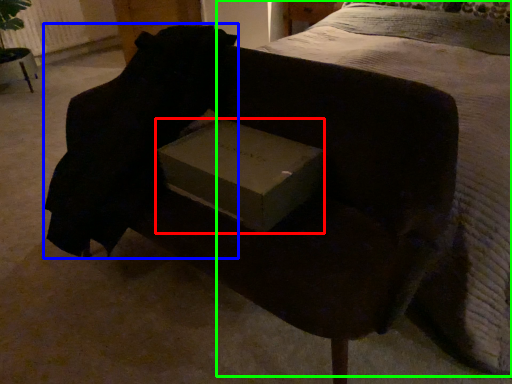
Question: Considering the real-world distances, which object is farthest from box (highlighted by a red box)? back (highlighted by a blue box) or bed (highlighted by a green box)?

Choices:
 (A) back
 (B) bed

Answer: (B)